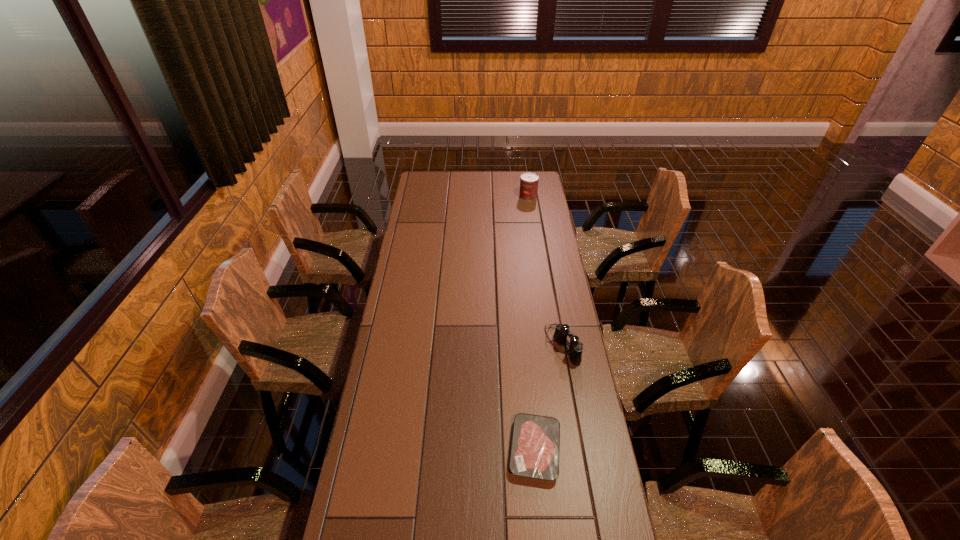
Find the location of a particular element. Image resolution: width=960 pixels, height=540 pixels. can located at the right edge is located at coordinates (529, 181).

I want to click on binoculars at the right edge, so click(x=562, y=331).

You are a GUI agent. You are given a task and a screenshot of the screen. Output one action in this format:
    pyautogui.click(x=<x>, y=<y>)
    Task: Click on the steak present at the right edge
    The width and height of the screenshot is (960, 540).
    Given the screenshot: What is the action you would take?
    pyautogui.click(x=535, y=447)

Locate an element on the screen. object that is at the far right corner is located at coordinates (529, 181).

Find the location of a particular element. free space at the far edge of the desktop is located at coordinates (505, 172).

Locate an element on the screen. This screenshot has height=540, width=960. free space at the left edge of the desktop is located at coordinates (430, 215).

At what (x,y) coordinates should I click in order to perform the action: click on vacant region at the right edge. Please return your answer as a coordinate pair (x, y). The width and height of the screenshot is (960, 540). Looking at the image, I should click on (540, 198).

Locate an element on the screen. This screenshot has width=960, height=540. vacant space at the far left corner of the desktop is located at coordinates (437, 189).

Where is `free spot between the can and the steak`? The width and height of the screenshot is (960, 540). free spot between the can and the steak is located at coordinates (532, 323).

Locate an element on the screen. This screenshot has height=540, width=960. vacant space that is in between the binoculars and the can is located at coordinates (545, 271).